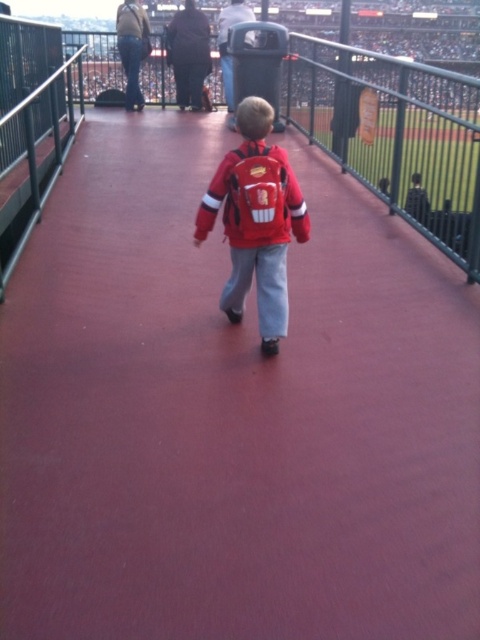
Who is shorter, metal/rail at left or matte red jacket at center?

Standing shorter between the two is matte red jacket at center.

Which is more to the left, metal/rail at left or matte red jacket at center?

Positioned to the left is metal/rail at left.

Which is in front, point (0, 177) or point (284, 172)?

Point (284, 172) is in front.

Where is `metal/rail at left`? The width and height of the screenshot is (480, 640). metal/rail at left is located at coordinates (35, 154).

Does matte red backpack at center appear on the right side of metal/rail at left?

Indeed, matte red backpack at center is positioned on the right side of metal/rail at left.

Who is lower down, matte red backpack at center or metal/rail at left?

matte red backpack at center

Between point (261, 173) and point (59, 156), which one is positioned behind?

Positioned behind is point (59, 156).

Where is `matte red backpack at center`? matte red backpack at center is located at coordinates (255, 220).

Does point (252, 232) come closer to viewer compared to point (289, 193)?

That is True.

Between matte red backpack at center and matte red jacket at center, which one appears on the left side from the viewer's perspective?

Positioned to the left is matte red backpack at center.

At what (x,y) coordinates should I click in order to perform the action: click on matte red backpack at center. Please return your answer as a coordinate pair (x, y). The height and width of the screenshot is (640, 480). Looking at the image, I should click on (255, 220).